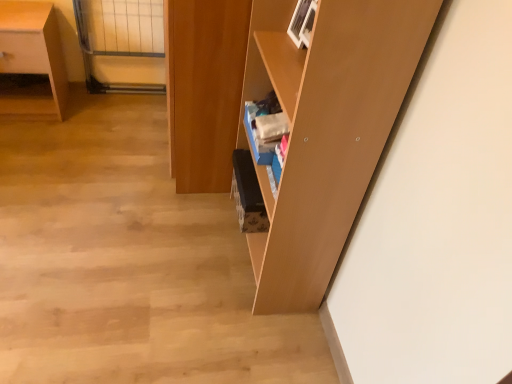
Question: From a real-world perspective, is matte wood shelf at center physically located above or below matte wood desk at left?

Choices:
 (A) above
 (B) below

Answer: (A)

Question: Does point (x=377, y=21) appear closer or farther from the camera than point (x=53, y=107)?

Choices:
 (A) closer
 (B) farther

Answer: (A)

Question: Estimate the real-world distances between objects in this image. Which object is closer to the matte wood shelf at center?

Choices:
 (A) wooden cabinet at center
 (B) matte wood desk at left
 (C) clear glass door at upper left

Answer: (A)

Question: Based on their relative distances, which object is nearer to the matte wood shelf at center?

Choices:
 (A) matte wood desk at left
 (B) wooden cabinet at center
 (C) clear glass door at upper left

Answer: (B)